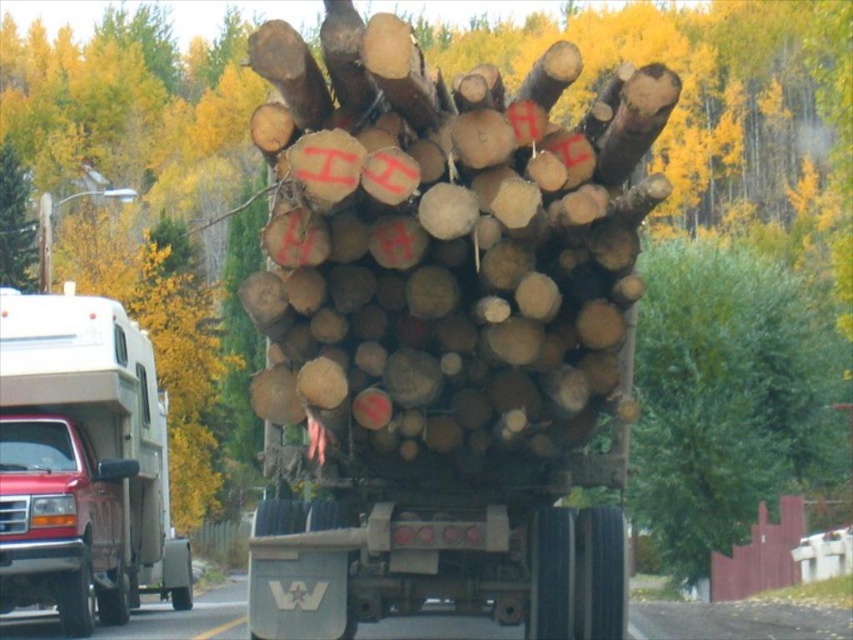
Is natural wood logs at center above green leafy tree at center?

Incorrect, natural wood logs at center is not positioned above green leafy tree at center.

From the picture: Can you confirm if natural wood logs at center is positioned below green leafy tree at center?

Correct, natural wood logs at center is located below green leafy tree at center.

What do you see at coordinates (444, 332) in the screenshot? This screenshot has width=853, height=640. I see `natural wood logs at center` at bounding box center [444, 332].

Locate an element on the screen. The height and width of the screenshot is (640, 853). natural wood logs at center is located at coordinates (444, 332).

Is green leafy tree at center positioned behind matte white truck at left?

No.

Who is more distant from viewer, (662, 246) or (6, 384)?

The point (662, 246) is more distant.

Identify the location of green leafy tree at center. The width and height of the screenshot is (853, 640). (729, 401).

Locate an element on the screen. green leafy tree at center is located at coordinates (729, 401).

Can you confirm if natural wood logs at center is shorter than matte white truck at left?

No.

Identify the location of natural wood logs at center. (444, 332).

Which is behind, point (402, 481) or point (64, 376)?

Point (64, 376)

The width and height of the screenshot is (853, 640). I want to click on natural wood logs at center, so click(x=444, y=332).